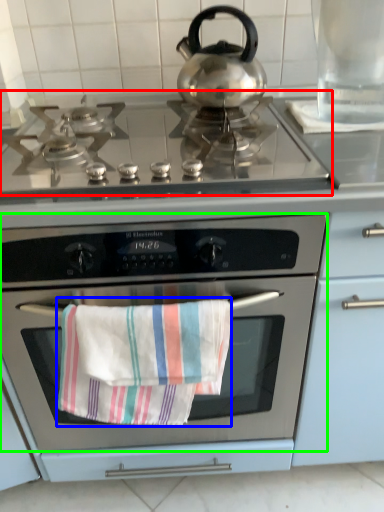
Question: Based on their relative distances, which object is nearer to gas stove (highlighted by a red box)? Choose from beach towel (highlighted by a blue box) and oven (highlighted by a green box).

Choices:
 (A) beach towel
 (B) oven

Answer: (B)